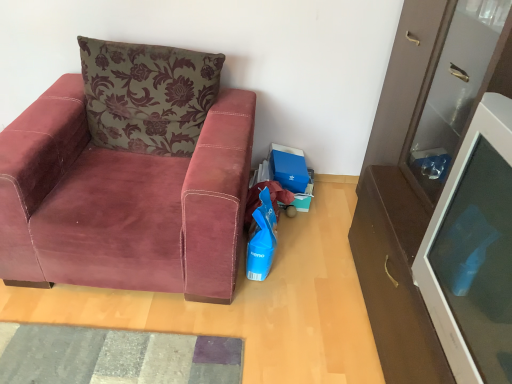
Question: Can you confirm if textured gray mat at lower left is shorter than velvet maroon armchair at left?

Choices:
 (A) yes
 (B) no

Answer: (A)

Question: Can you confirm if textured gray mat at lower left is thinner than velvet maroon armchair at left?

Choices:
 (A) yes
 (B) no

Answer: (A)

Question: Could you tell me if textured gray mat at lower left is turned towards velvet maroon armchair at left?

Choices:
 (A) yes
 (B) no

Answer: (A)

Question: Is textured gray mat at lower left wider than velvet maroon armchair at left?

Choices:
 (A) no
 (B) yes

Answer: (A)

Question: Is textured gray mat at lower left outside velvet maroon armchair at left?

Choices:
 (A) no
 (B) yes

Answer: (B)

Question: Is there a large distance between textured gray mat at lower left and velvet maroon armchair at left?

Choices:
 (A) no
 (B) yes

Answer: (A)

Question: Is white glossy cabinet at right bigger than velvet maroon armchair at left?

Choices:
 (A) yes
 (B) no

Answer: (B)

Question: Is white glossy cabinet at right to the left of velvet maroon armchair at left from the viewer's perspective?

Choices:
 (A) no
 (B) yes

Answer: (A)

Question: Would you say white glossy cabinet at right is a long distance from velvet maroon armchair at left?

Choices:
 (A) yes
 (B) no

Answer: (B)

Question: Considering the relative sizes of white glossy cabinet at right and velvet maroon armchair at left in the image provided, is white glossy cabinet at right smaller than velvet maroon armchair at left?

Choices:
 (A) yes
 (B) no

Answer: (A)

Question: Is white glossy cabinet at right positioned behind velvet maroon armchair at left?

Choices:
 (A) no
 (B) yes

Answer: (A)

Question: Can you confirm if white glossy cabinet at right is wider than velvet maroon armchair at left?

Choices:
 (A) no
 (B) yes

Answer: (A)

Question: From a real-world perspective, is velvet maroon armchair at left located beneath velvet floral pillow at upper left?

Choices:
 (A) no
 (B) yes

Answer: (B)